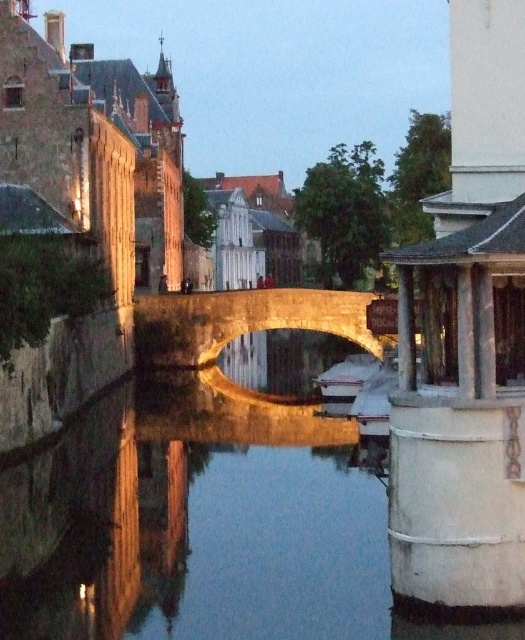
In the scene shown: You are a tourist standing on the stone arch bridge at center and want to cross to the other side. The smooth concrete river at center is flowing beneath you. Considering the river is narrower than the bridge, can you safely walk across the bridge to the opposite bank without stepping onto the river?

The smooth concrete river at center is narrower than the stone arch bridge at center, so the bridge spans the river completely. Therefore, you can safely walk across the stone arch bridge at center to the opposite bank without stepping onto the river.

You are a tourist standing on the stone arch bridge at center and want to take a photo of the smooth concrete river at center. Which direction should you look to capture the river in your camera?

You should look downward since the smooth concrete river at center is located below the stone arch bridge at center.

You are a tourist standing on the left bank of the canal. You want to take a photo of the white plastic boat at center from the stone arch bridge at center. Can you do so without moving from your current position?

The stone arch bridge at center is positioned on the left side of the white plastic boat at center, so you can take the photo without moving from your current position on the left bank.